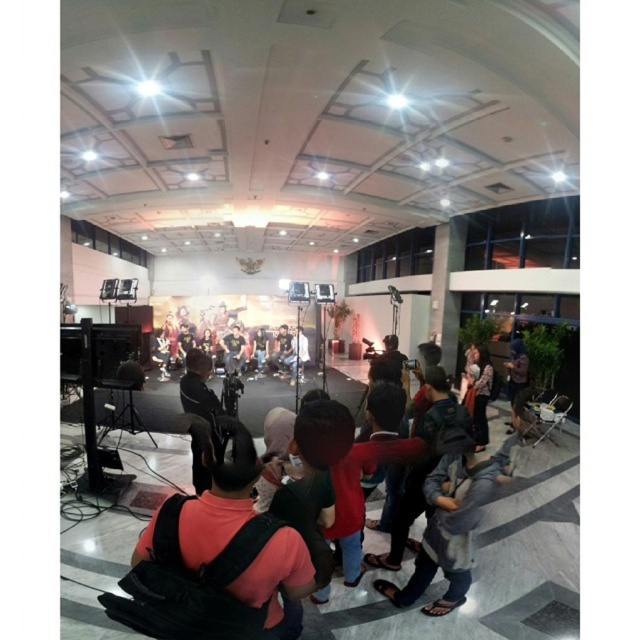
You are a photographer at the event and need to retrieve your matte black camera at center. There is a matte black backpack at center in the way. Can you reach your camera without moving the backpack?

The matte black backpack at center is closer to the viewer than the matte black camera at center, so the backpack is blocking access to the camera. You would need to move the backpack to reach the camera.